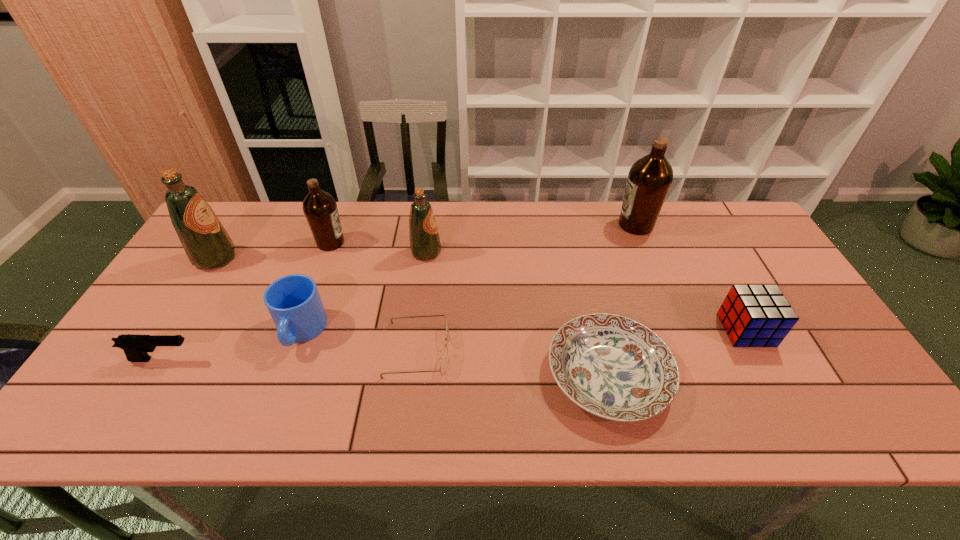
Identify the location of object that is at the far left corner. The height and width of the screenshot is (540, 960). (207, 244).

Locate an element on the screen. The height and width of the screenshot is (540, 960). blank space at the far edge of the desktop is located at coordinates (464, 213).

Image resolution: width=960 pixels, height=540 pixels. Identify the location of free point at the near edge. (332, 423).

Image resolution: width=960 pixels, height=540 pixels. What are the coordinates of `vacant space at the left edge of the desktop` in the screenshot? It's located at (152, 313).

Image resolution: width=960 pixels, height=540 pixels. In the image, there is a desktop. What are the coordinates of `free space at the right edge` in the screenshot? It's located at (804, 304).

The height and width of the screenshot is (540, 960). In the image, there is a desktop. What are the coordinates of `free space at the far left corner` in the screenshot? It's located at (226, 222).

Where is `vacant region at the far right corner of the desktop`? The width and height of the screenshot is (960, 540). vacant region at the far right corner of the desktop is located at coordinates (729, 234).

Locate an element on the screen. The height and width of the screenshot is (540, 960). empty location between the left green olive oil and the left brown olive oil is located at coordinates (274, 251).

What are the coordinates of `vacant area that lies between the plate and the smaller brown olive oil` in the screenshot? It's located at (469, 308).

You are a GUI agent. You are given a task and a screenshot of the screen. Output one action in this format:
    pyautogui.click(x=<x>, y=<y>)
    Task: Click on the vacant area between the left brown olive oil and the plate
    The height and width of the screenshot is (540, 960).
    Given the screenshot: What is the action you would take?
    pyautogui.click(x=469, y=308)